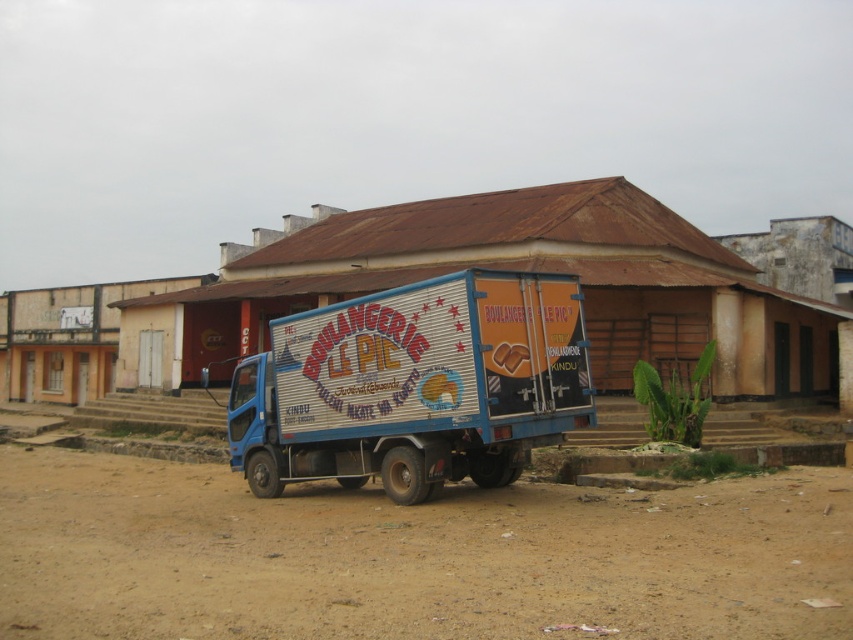
Question: Can you confirm if brown sandy dirt at lower center is bigger than blue metallic truck at center?

Choices:
 (A) yes
 (B) no

Answer: (A)

Question: Which object appears closest to the camera in this image?

Choices:
 (A) brown sandy dirt at lower center
 (B) blue metallic truck at center

Answer: (A)

Question: Does brown sandy dirt at lower center have a greater width compared to blue metallic truck at center?

Choices:
 (A) yes
 (B) no

Answer: (A)

Question: Where is brown sandy dirt at lower center located in relation to blue metallic truck at center in the image?

Choices:
 (A) right
 (B) left

Answer: (A)